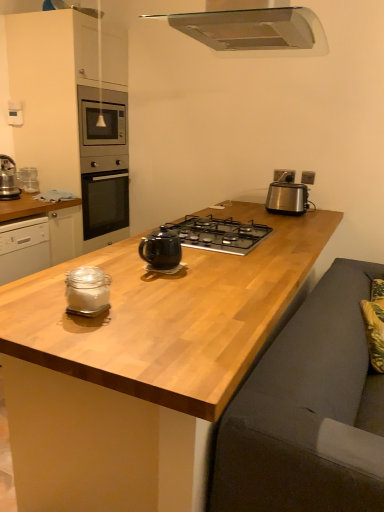
In order to click on empty space that is in between black glossy teapot at center and clear glass jar at center in this screenshot , I will do `click(134, 285)`.